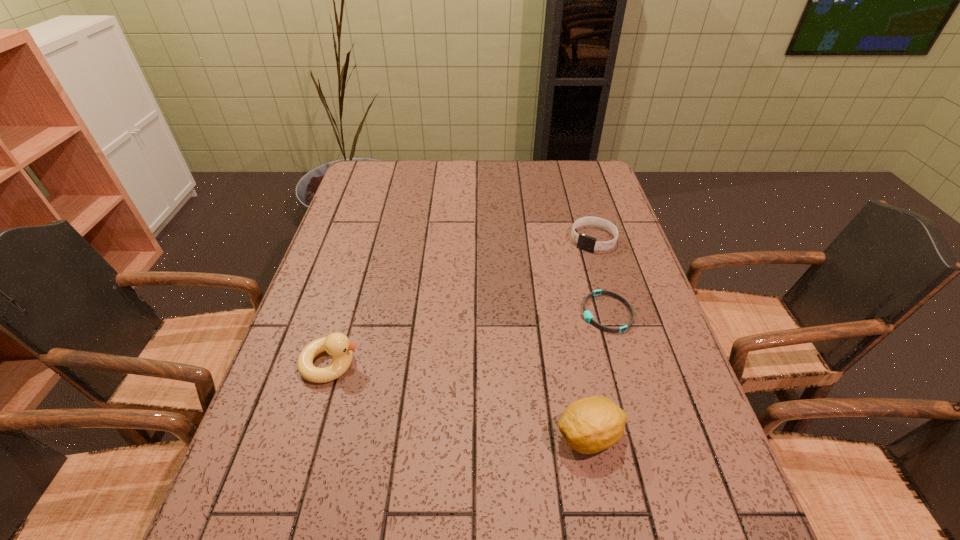
You are a GUI agent. You are given a task and a screenshot of the screen. Output one action in this format:
    pyautogui.click(x=<x>, y=<y>)
    Task: Click on the vacant space on the desktop that is between the duckling and the lemon and is positioned on the buckle of the second farthest object
    This screenshot has height=540, width=960.
    Given the screenshot: What is the action you would take?
    pyautogui.click(x=429, y=391)

This screenshot has height=540, width=960. Identify the location of free space on the desktop that is between the second nearest object and the nearest object and is positioned on the outer surface of the farther wristband. (475, 404).